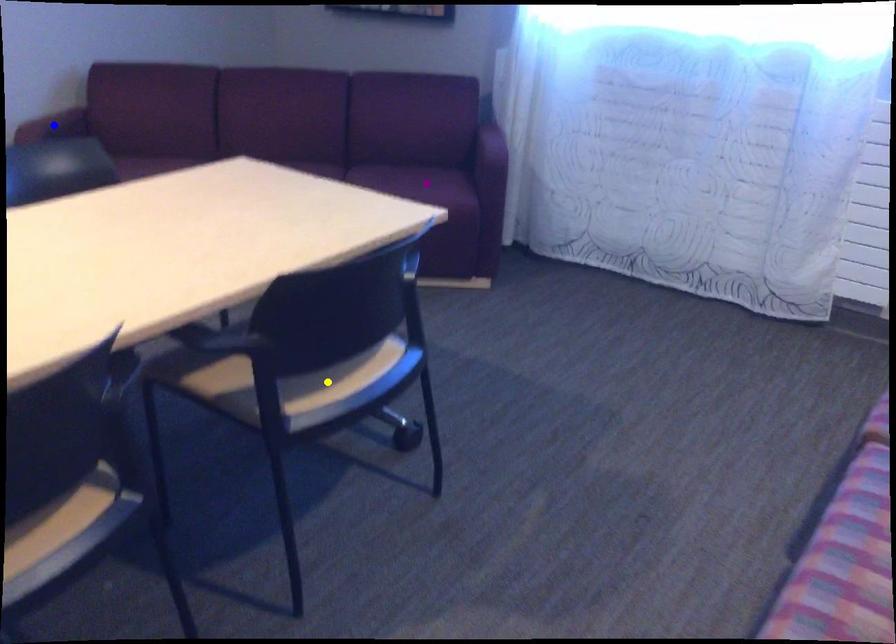
Order these from nearest to farthest:
- blue point
- yellow point
- purple point

yellow point < blue point < purple point